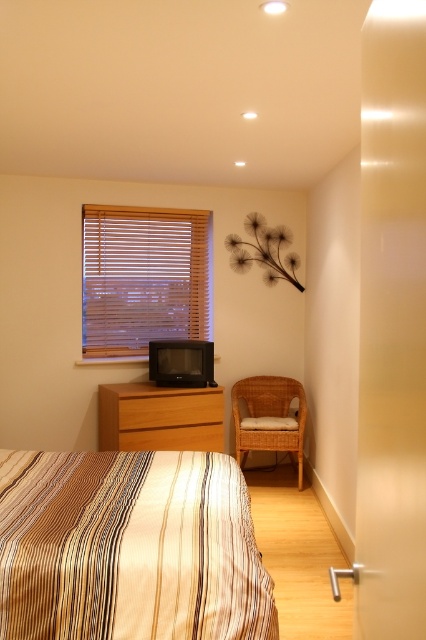
Question: Estimate the real-world distances between objects in this image. Which object is farther from the light brown wood drawer at center?

Choices:
 (A) woven wicker chair at right
 (B) light brown wood dresser at lower left
 (C) striped fabric bed at lower left
 (D) wooden blinds at upper left

Answer: (C)

Question: Which of the following is the farthest from the observer?

Choices:
 (A) (66, 474)
 (B) (123, 412)
 (C) (193, 436)

Answer: (C)

Question: Can you confirm if wooden blinds at upper left is smaller than light brown wood drawer at center?

Choices:
 (A) no
 (B) yes

Answer: (A)

Question: Which object is the closest to the striped fabric bed at lower left?

Choices:
 (A) wooden blinds at upper left
 (B) woven wicker chair at right
 (C) light brown wood dresser at lower left

Answer: (C)

Question: Does light brown wood dresser at lower left lie in front of light brown wood drawer at center?

Choices:
 (A) no
 (B) yes

Answer: (A)

Question: Does light brown wood dresser at lower left lie behind light brown wood drawer at center?

Choices:
 (A) no
 (B) yes

Answer: (B)